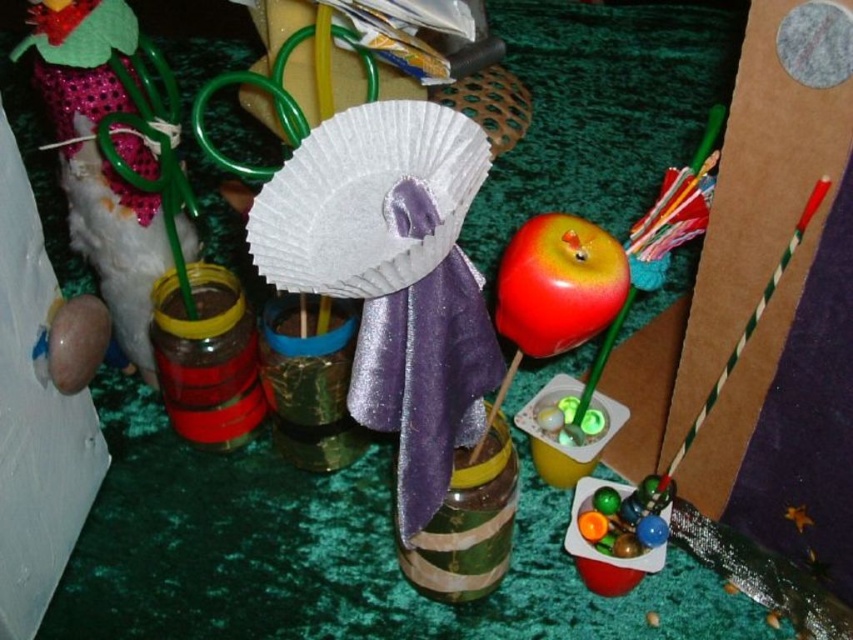
Question: Which point is farther to the camera?

Choices:
 (A) cardboard at right
 (B) matte brown jar at left
 (C) shiny red apple at center

Answer: (B)

Question: Can you confirm if cardboard at right is wider than shiny red apple at center?

Choices:
 (A) yes
 (B) no

Answer: (A)

Question: Which object appears closest to the camera in this image?

Choices:
 (A) shiny red apple at center
 (B) cardboard at right
 (C) matte brown jar at left

Answer: (B)

Question: Where is matte brown jar at left located in relation to shiny red apple at center in the image?

Choices:
 (A) below
 (B) above

Answer: (B)

Question: Is matte brown jar at left positioned before shiny red apple at center?

Choices:
 (A) no
 (B) yes

Answer: (A)

Question: Which object is the farthest from the shiny red apple at center?

Choices:
 (A) cardboard at right
 (B) matte brown jar at left

Answer: (B)